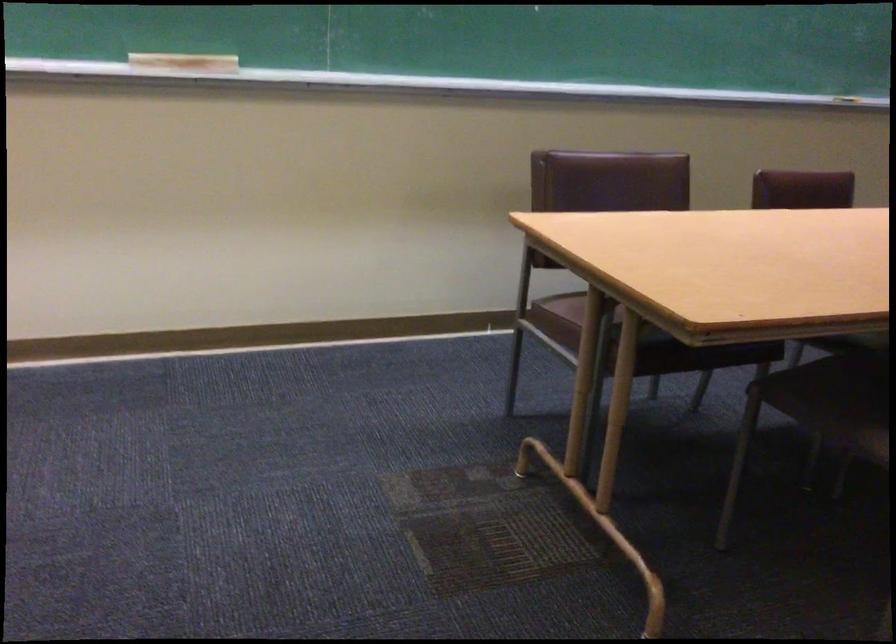
Identify the location of chalkboard eraser. Image resolution: width=896 pixels, height=644 pixels. (183, 64).